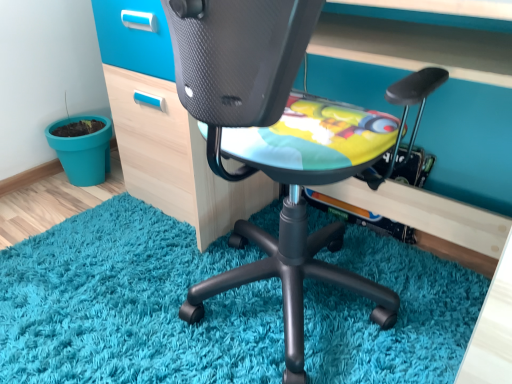
Locate an element on the screen. The height and width of the screenshot is (384, 512). teal plastic flowerpot at lower left is located at coordinates (83, 151).

Image resolution: width=512 pixels, height=384 pixels. Describe the element at coordinates (83, 151) in the screenshot. I see `teal plastic flowerpot at lower left` at that location.

The image size is (512, 384). Describe the element at coordinates (280, 142) in the screenshot. I see `matte black chair at center` at that location.

I want to click on matte black chair at center, so click(x=280, y=142).

What is the approximate height of matte black chair at center?

It is 30.52 inches.

Find the location of a particular element. The width and height of the screenshot is (512, 384). teal plastic flowerpot at lower left is located at coordinates (83, 151).

Based on their positions, is matte black chair at center located to the left or right of teal plastic flowerpot at lower left?

From the image, it's evident that matte black chair at center is to the right of teal plastic flowerpot at lower left.

Who is more distant, matte black chair at center or teal plastic flowerpot at lower left?

teal plastic flowerpot at lower left is further from the camera.

Is point (219, 26) more distant than point (97, 180)?

No, (219, 26) is in front of (97, 180).

From the image's perspective, is matte black chair at center over teal plastic flowerpot at lower left?

No, from the image's perspective, matte black chair at center is not on top of teal plastic flowerpot at lower left.

From a real-world perspective, which is physically above, matte black chair at center or teal plastic flowerpot at lower left?

In real-world perspective, matte black chair at center is above.

Can you confirm if matte black chair at center is wider than teal plastic flowerpot at lower left?

Indeed, matte black chair at center has a greater width compared to teal plastic flowerpot at lower left.

Which of these two, matte black chair at center or teal plastic flowerpot at lower left, stands shorter?

teal plastic flowerpot at lower left.

Is matte black chair at center smaller than teal plastic flowerpot at lower left?

Incorrect, matte black chair at center is not smaller in size than teal plastic flowerpot at lower left.

Could teal plastic flowerpot at lower left be considered to be inside matte black chair at center?

No, teal plastic flowerpot at lower left is not inside matte black chair at center.

Is matte black chair at center not near teal plastic flowerpot at lower left?

Yes, matte black chair at center and teal plastic flowerpot at lower left are quite far apart.

Consider the image. Is matte black chair at center facing away from teal plastic flowerpot at lower left?

No, matte black chair at center is not facing away from teal plastic flowerpot at lower left.

Where is `chair in front of the teal plastic flowerpot at lower left`? The height and width of the screenshot is (384, 512). chair in front of the teal plastic flowerpot at lower left is located at coordinates (280, 142).

Can you confirm if teal plastic flowerpot at lower left is positioned to the left of matte black chair at center?

Yes, teal plastic flowerpot at lower left is to the left of matte black chair at center.

Which is in front, teal plastic flowerpot at lower left or matte black chair at center?

matte black chair at center is closer to the camera.

Which point is more forward, (90, 117) or (213, 77)?

The point (213, 77) is more forward.

From the image's perspective, is teal plastic flowerpot at lower left located above matte black chair at center?

Yes, from the image's perspective, teal plastic flowerpot at lower left is over matte black chair at center.

From a real-world perspective, which is physically above, teal plastic flowerpot at lower left or matte black chair at center?

matte black chair at center.

Does teal plastic flowerpot at lower left have a greater width compared to matte black chair at center?

Incorrect, the width of teal plastic flowerpot at lower left does not surpass that of matte black chair at center.

Can you confirm if teal plastic flowerpot at lower left is taller than matte black chair at center?

In fact, teal plastic flowerpot at lower left may be shorter than matte black chair at center.

Who is bigger, teal plastic flowerpot at lower left or matte black chair at center?

matte black chair at center is bigger.

Consider the image. Is teal plastic flowerpot at lower left outside of matte black chair at center?

Yes, teal plastic flowerpot at lower left is not within matte black chair at center.

Is teal plastic flowerpot at lower left positioned far away from matte black chair at center?

Yes, teal plastic flowerpot at lower left and matte black chair at center are quite far apart.

Is teal plastic flowerpot at lower left turned away from matte black chair at center?

No, teal plastic flowerpot at lower left is not facing the opposite direction of matte black chair at center.

Can you tell me how much teal plastic flowerpot at lower left and matte black chair at center differ in facing direction?

The angle between the facing direction of teal plastic flowerpot at lower left and the facing direction of matte black chair at center is 180 degrees.

How much distance is there between teal plastic flowerpot at lower left and matte black chair at center?

A distance of 1.03 meters exists between teal plastic flowerpot at lower left and matte black chair at center.

The width and height of the screenshot is (512, 384). What are the coordinates of `chair above the teal plastic flowerpot at lower left (from a real-world perspective)` in the screenshot? It's located at (280, 142).

The height and width of the screenshot is (384, 512). I want to click on chair that appears on the right of teal plastic flowerpot at lower left, so click(x=280, y=142).

Where is `flowerpot located underneath the matte black chair at center (from a real-world perspective)`? flowerpot located underneath the matte black chair at center (from a real-world perspective) is located at coordinates (83, 151).